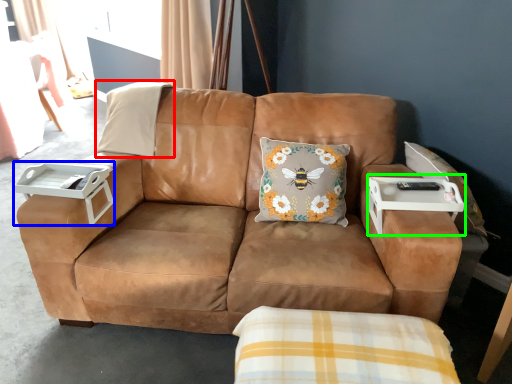
Question: Based on their relative distances, which object is nearer to pillow (highlighted by a red box)? Choose from table (highlighted by a blue box) and table (highlighted by a green box).

Choices:
 (A) table
 (B) table

Answer: (A)